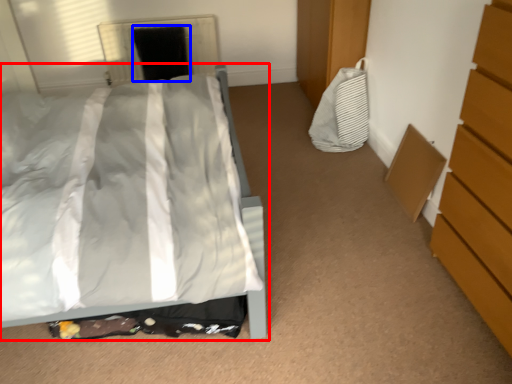
Question: Which object appears farthest to the camera in this image, bed (highlighted by a red box) or screen door (highlighted by a blue box)?

Choices:
 (A) bed
 (B) screen door

Answer: (B)